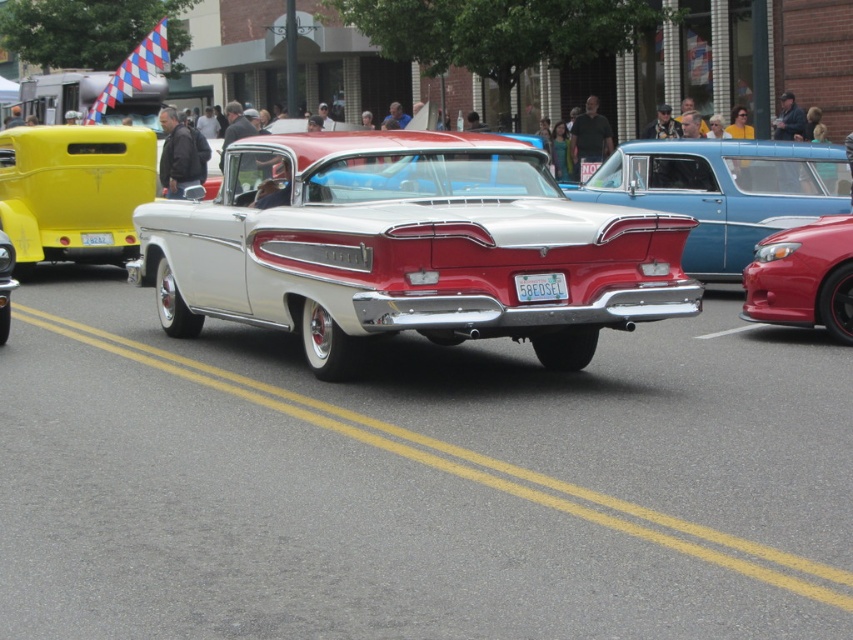
Does white glossy car at center have a lesser height compared to white plastic license plate at center?

No.

Does white glossy car at center have a smaller size compared to white plastic license plate at center?

No.

Who is more forward, (222, 310) or (525, 278)?

Point (525, 278) is in front.

This screenshot has height=640, width=853. I want to click on white glossy car at center, so click(405, 248).

Where is `white glossy sedan at center`? The image size is (853, 640). white glossy sedan at center is located at coordinates (723, 192).

Who is taller, white glossy sedan at center or white plastic license plate at center?

white glossy sedan at center is taller.

Between point (776, 150) and point (527, 285), which one is positioned behind?

The point (776, 150) is behind.

You are a GUI agent. You are given a task and a screenshot of the screen. Output one action in this format:
    pyautogui.click(x=<x>, y=<y>)
    Task: Click on the white glossy sedan at center
    
    Given the screenshot: What is the action you would take?
    click(723, 192)

Can you confirm if white glossy car at center is bigger than white glossy sedan at center?

Yes, white glossy car at center is bigger than white glossy sedan at center.

Is the position of white glossy car at center more distant than that of white glossy sedan at center?

That is False.

Which is behind, point (592, 225) or point (686, 176)?

The point (686, 176) is more distant.

Find the location of a particular element. The width and height of the screenshot is (853, 640). white glossy car at center is located at coordinates (405, 248).